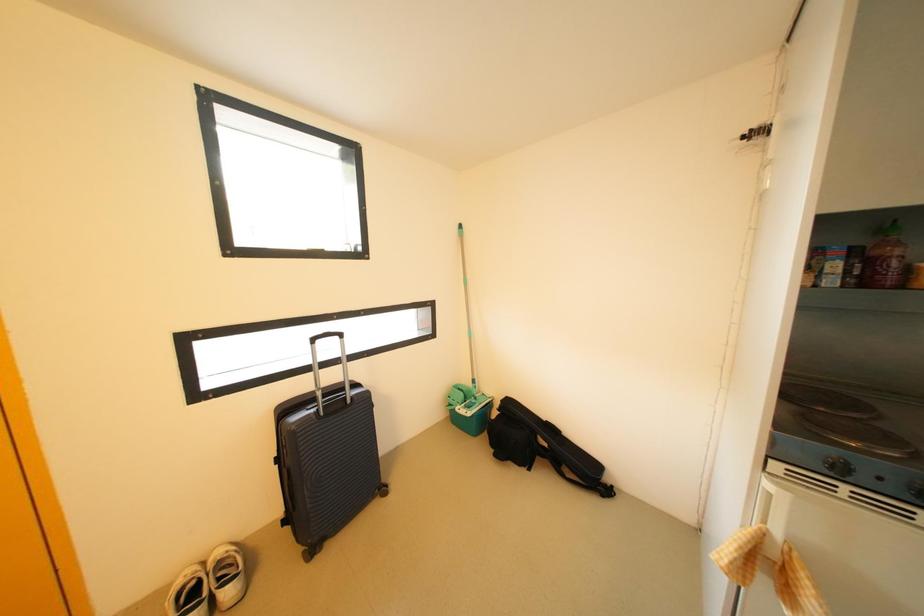
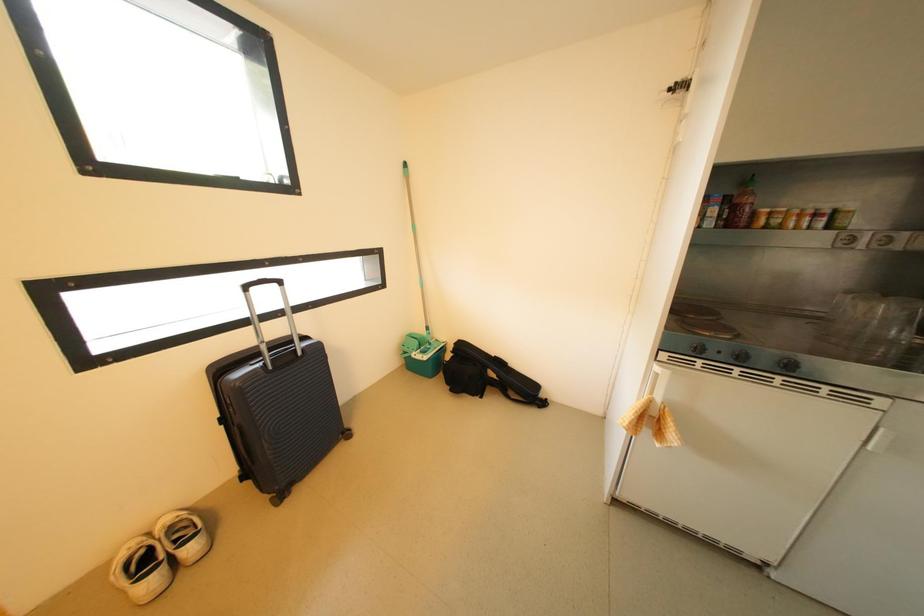
Question: How did the camera likely rotate?

Choices:
 (A) Left
 (B) Right
 (C) Up
 (D) Down

Answer: (B)